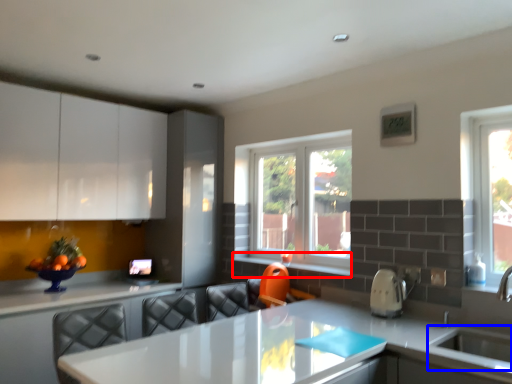
Question: Which of the following is the farthest to the observer, window sill (highlighted by a red box) or sink (highlighted by a blue box)?

Choices:
 (A) window sill
 (B) sink

Answer: (A)